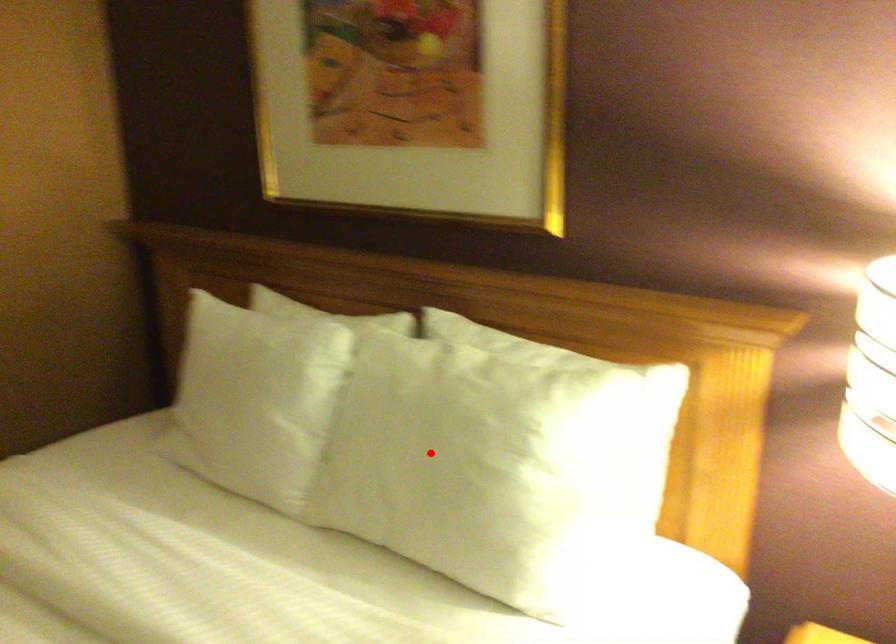
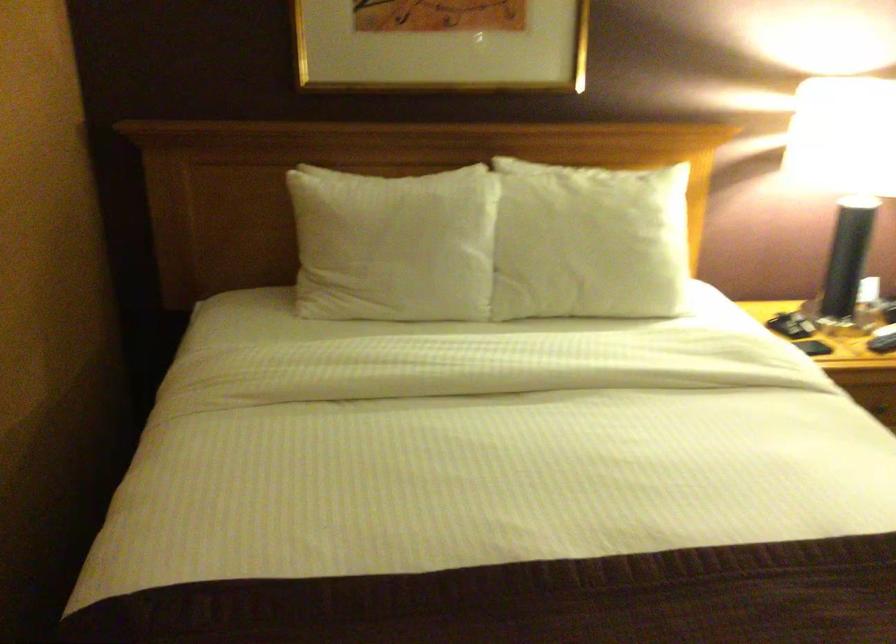
Question: I am providing you with two images of the same scene from different viewpoints. In image1, a red point is highlighted. Considering the same 3D point in image2, which of the following is correct?

Choices:
 (A) It is closer
 (B) It is farther

Answer: (B)